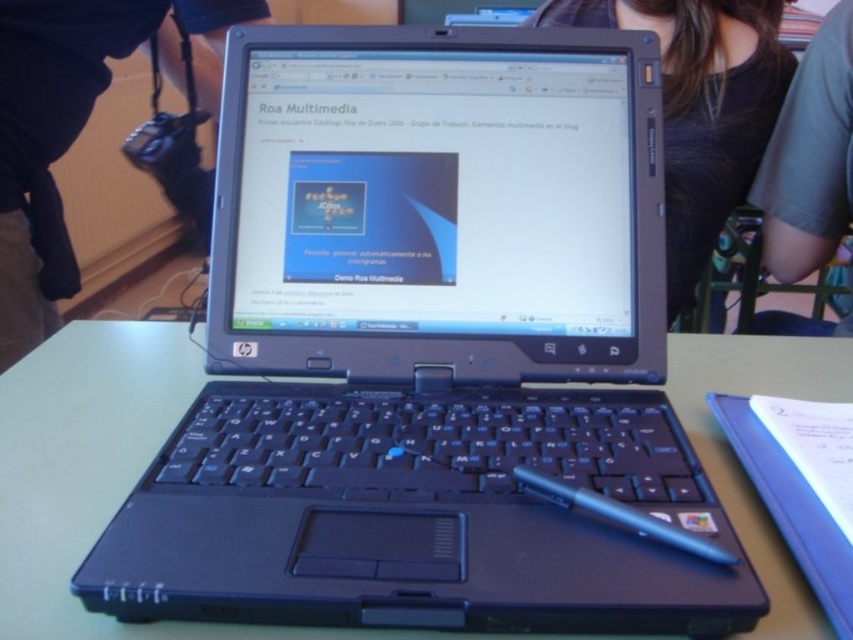
You are trying to place a 10 cm tall paperweight on the green matte table at center without it touching the black plastic laptop at center. Is there enough vertical space between them?

The green matte table at center has a lesser height compared to black plastic laptop at center, meaning the table is shorter than the laptop. Since the paperweight is only 10 cm tall, placing it on the table won